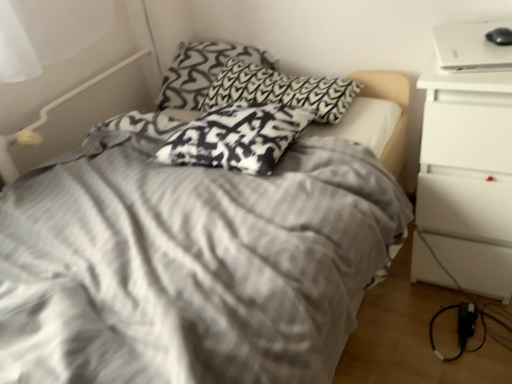
Find the location of `space that is in front of black and white patterned pillow at center, the first pillow when ordered from front to back`. space that is in front of black and white patterned pillow at center, the first pillow when ordered from front to back is located at coordinates (244, 206).